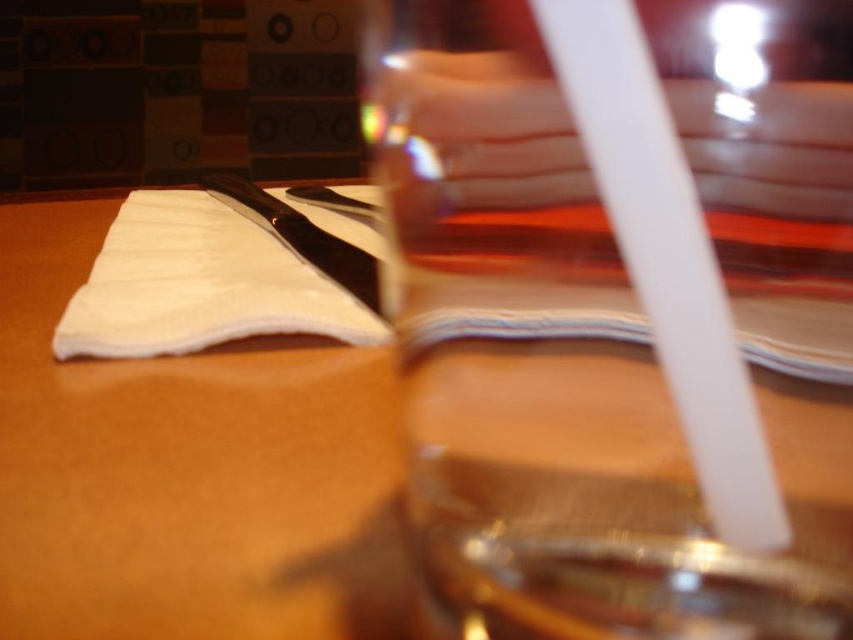
From the picture: You are a server at a restaurant and need to place a new plate on the table. The plate is the same size as the white fabric at center. Based on the scene, will the plate fit entirely on the wooden table at center?

The wooden table at center is larger in size than the white fabric at center, so the plate will fit entirely on the wooden table at center since it is bigger than the fabric.

You are a waiter trying to place a new menu on the table without obstructing the transparent glass at center. Given the table coordinates, where should you place the menu to avoid covering the glass? The glass is located at point (561,372).

The transparent glass at center is located at point (561,372), so place the menu away from this coordinate to avoid covering it.

You are a waiter trying to place a dessert plate between the transparent glass at center and the polished metal knife at center. Can you fit the plate there if the plate is 15 cm wide?

The transparent glass at center has a lesser width compared to polished metal knife at center. Since the glass is narrower than the knife, the space between them might be sufficient. However, without knowing the exact distance between them, it is uncertain if the 15 cm plate will fit. More information about the spacing is needed.